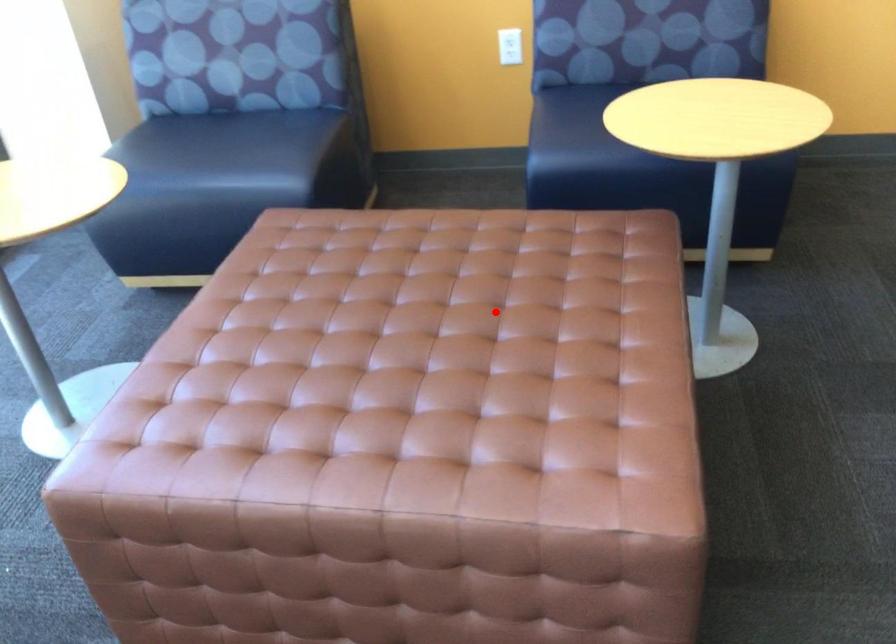
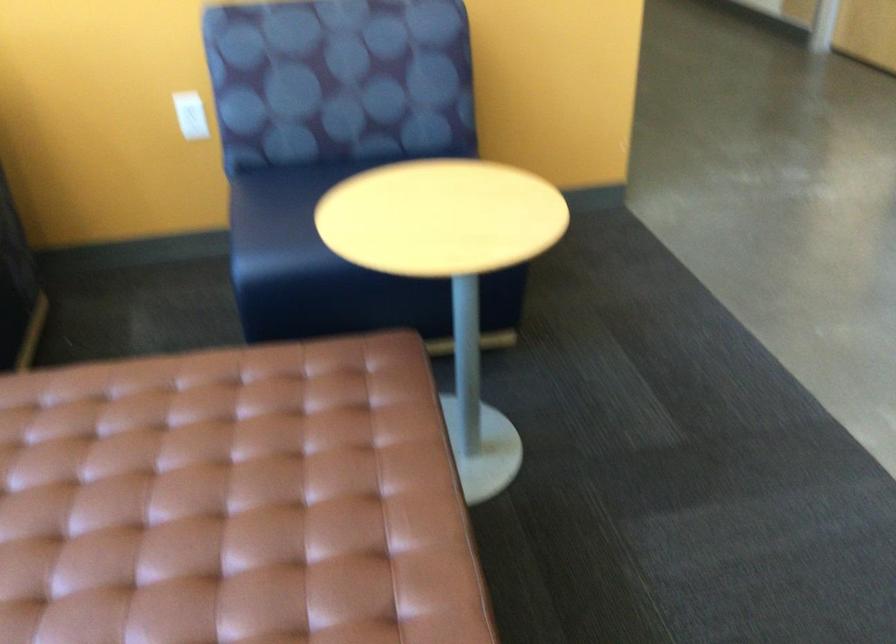
Question: A red point is marked in image1. In image2, is the corresponding 3D point closer to the camera or farther? Reply with the corresponding letter.

Choices:
 (A) The corresponding 3D point is closer.
 (B) The corresponding 3D point is farther.

Answer: (A)